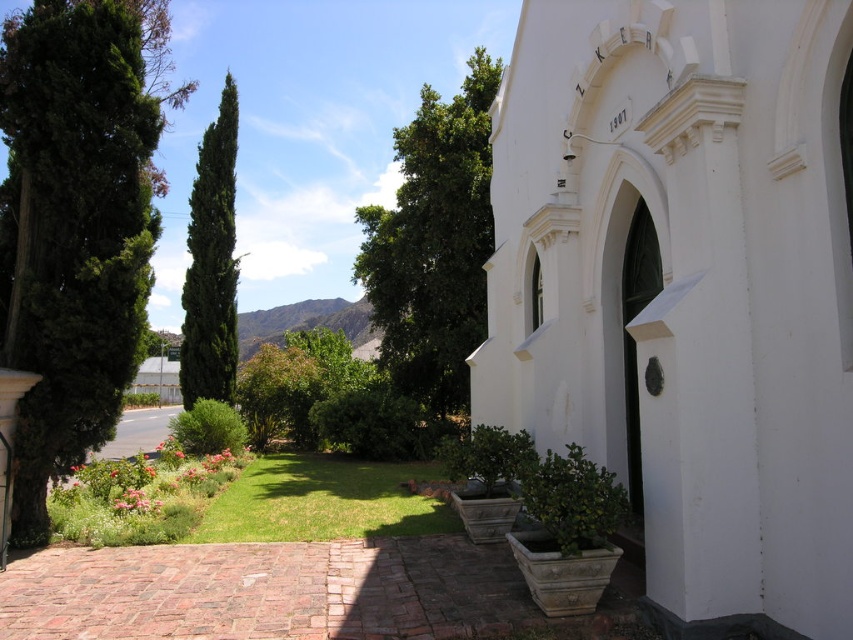
Question: Which object is the closest to the green textured tree at center?

Choices:
 (A) brick paved path at lower center
 (B) white smooth church at center

Answer: (A)

Question: Is white smooth church at center thinner than green leafy tree at left?

Choices:
 (A) yes
 (B) no

Answer: (A)

Question: Observing the image, what is the correct spatial positioning of white smooth church at center in reference to green leafy tree at left?

Choices:
 (A) below
 (B) above

Answer: (A)

Question: Can you confirm if green leafy tree at left is positioned above green leafy bush at center?

Choices:
 (A) yes
 (B) no

Answer: (A)

Question: Based on their relative distances, which object is nearer to the brick paved path at lower center?

Choices:
 (A) green leafy tree at center
 (B) green leafy tree at left
 (C) green textured tree at center

Answer: (B)

Question: Which point appears closest to the camera in this image?

Choices:
 (A) (381, 632)
 (B) (219, 428)
 (C) (13, 310)

Answer: (A)